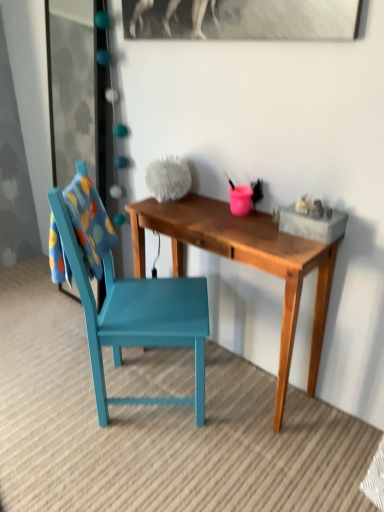
Question: Is the depth of transparent glass door at upper left greater than that of wooden desk at center?

Choices:
 (A) yes
 (B) no

Answer: (A)

Question: Does transparent glass door at upper left have a greater width compared to wooden desk at center?

Choices:
 (A) yes
 (B) no

Answer: (B)

Question: From a real-world perspective, is transparent glass door at upper left positioned over wooden desk at center based on gravity?

Choices:
 (A) yes
 (B) no

Answer: (A)

Question: Is transparent glass door at upper left not near wooden desk at center?

Choices:
 (A) no
 (B) yes

Answer: (B)

Question: Considering the relative sizes of transparent glass door at upper left and wooden desk at center in the image provided, is transparent glass door at upper left thinner than wooden desk at center?

Choices:
 (A) yes
 (B) no

Answer: (A)

Question: Considering the relative sizes of transparent glass door at upper left and wooden desk at center in the image provided, is transparent glass door at upper left taller than wooden desk at center?

Choices:
 (A) no
 (B) yes

Answer: (B)

Question: Considering the relative sizes of wooden desk at center and teal painted wood chair at left in the image provided, is wooden desk at center taller than teal painted wood chair at left?

Choices:
 (A) no
 (B) yes

Answer: (A)

Question: Is teal painted wood chair at left a part of wooden desk at center?

Choices:
 (A) yes
 (B) no

Answer: (B)

Question: Does wooden desk at center have a smaller size compared to teal painted wood chair at left?

Choices:
 (A) yes
 (B) no

Answer: (A)

Question: Does wooden desk at center have a larger size compared to teal painted wood chair at left?

Choices:
 (A) yes
 (B) no

Answer: (B)

Question: Is wooden desk at center located outside teal painted wood chair at left?

Choices:
 (A) yes
 (B) no

Answer: (A)

Question: Can you confirm if wooden desk at center is wider than teal painted wood chair at left?

Choices:
 (A) yes
 (B) no

Answer: (B)

Question: Does teal painted wood chair at left have a lesser width compared to transparent glass door at upper left?

Choices:
 (A) yes
 (B) no

Answer: (B)